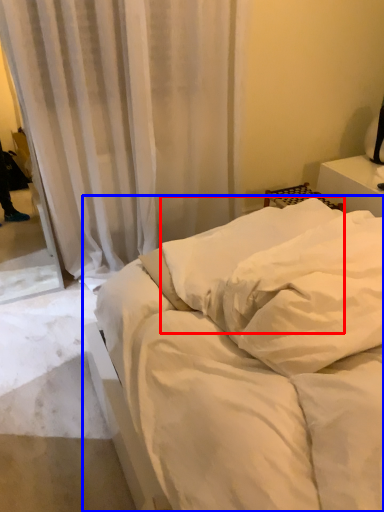
Question: Among these objects, which one is farthest to the camera, pillow (highlighted by a red box) or bed (highlighted by a blue box)?

Choices:
 (A) pillow
 (B) bed

Answer: (A)